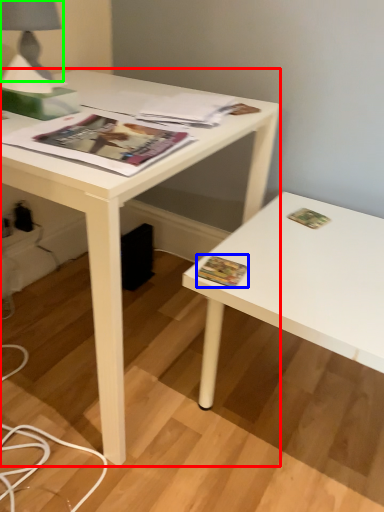
Question: Which is nearer to the desk (highlighted by a red box)? paperback book (highlighted by a blue box) or table lamp (highlighted by a green box).

Choices:
 (A) paperback book
 (B) table lamp

Answer: (B)